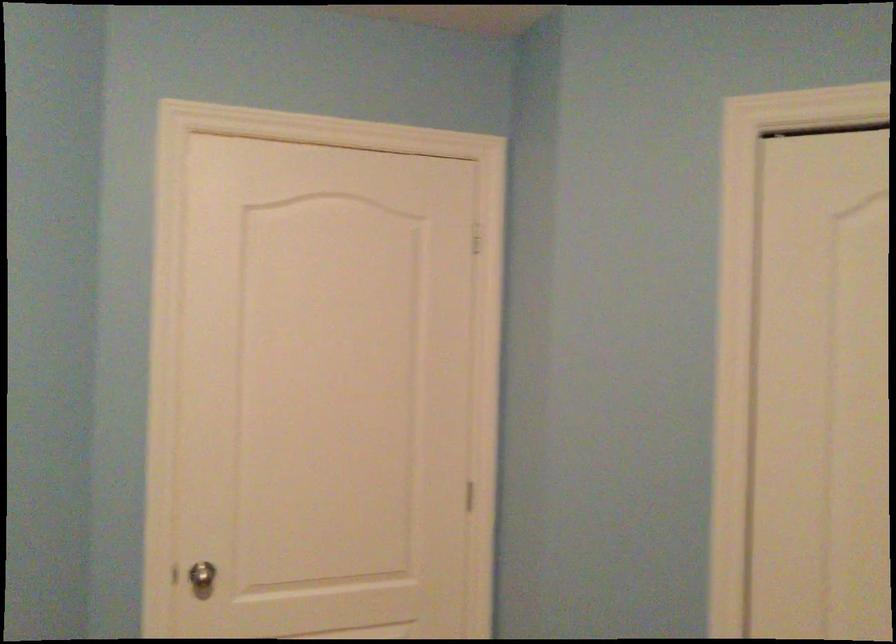
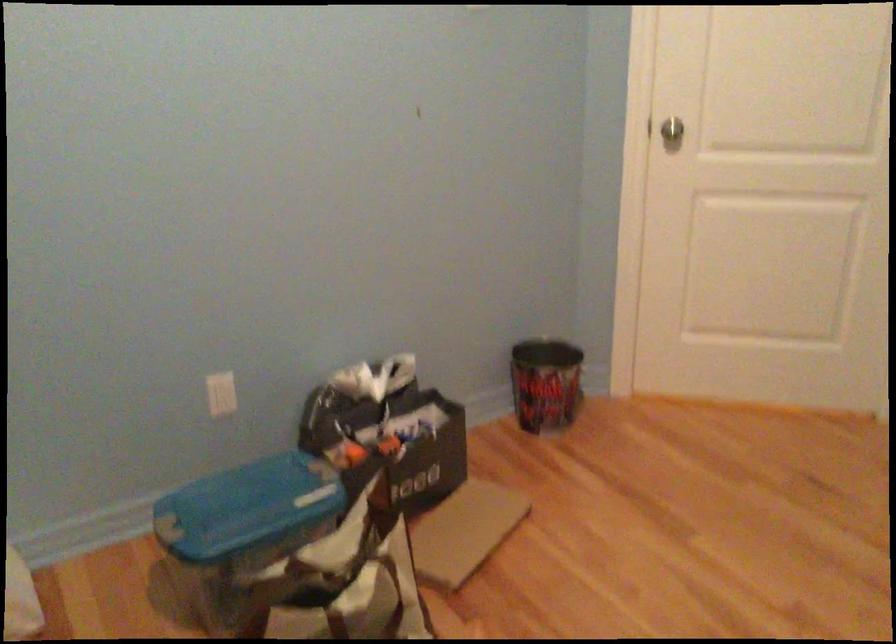
Locate, in the second image, the point that corresponds to the point at 194,564 in the first image.

(667, 128)